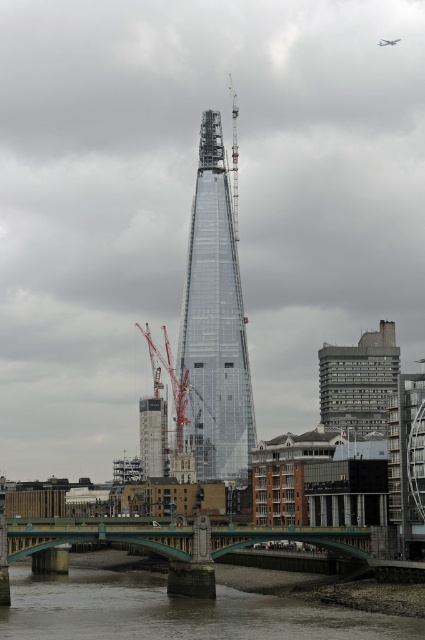
Question: Is gray concrete building at center positioned before metallic silver airplane at upper center?

Choices:
 (A) yes
 (B) no

Answer: (A)

Question: Which is farther from the transparent glass tower at center?

Choices:
 (A) gray concrete building at center
 (B) glassy transparent building at center
 (C) red metallic crane at center

Answer: (A)

Question: Which is farther from the transparent glass tower at center?

Choices:
 (A) green metallic bridge at lower center
 (B) gray concrete building at center

Answer: (A)

Question: Does brown sedimentary river at lower center appear under glassy transparent building at center?

Choices:
 (A) no
 (B) yes

Answer: (B)

Question: Is transparent glass tower at center to the left of glassy transparent building at center from the viewer's perspective?

Choices:
 (A) no
 (B) yes

Answer: (A)

Question: Which point appears farthest from the camera in this image?

Choices:
 (A) coord(367,404)
 (B) coord(192,342)
 (C) coord(263,616)

Answer: (B)